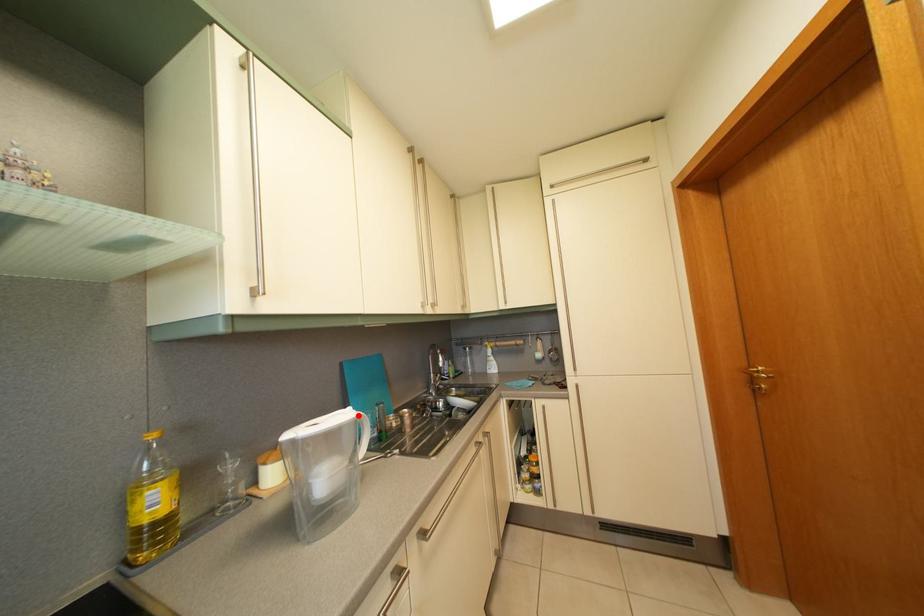
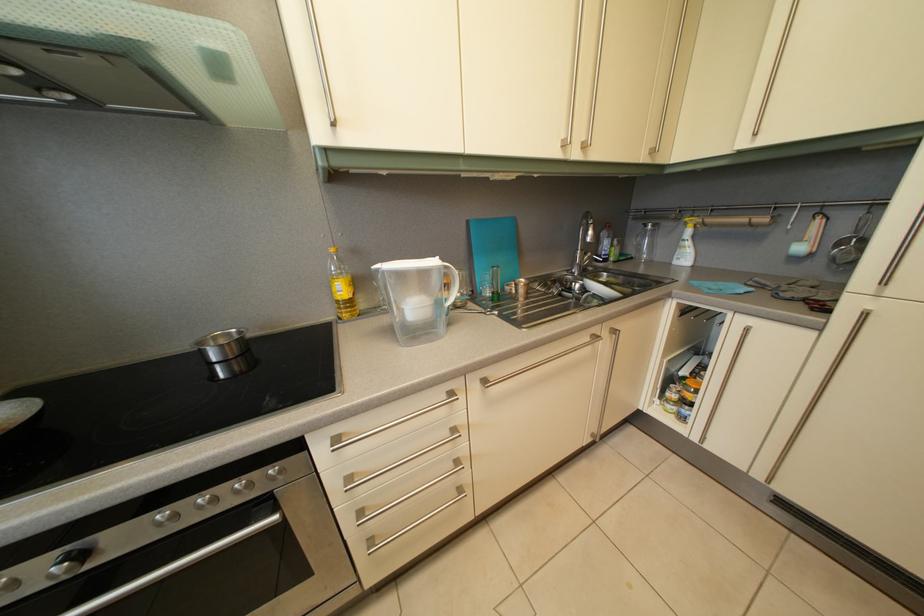
Find the pixel in the second image that matches the highlighted location in the first image.

(445, 265)